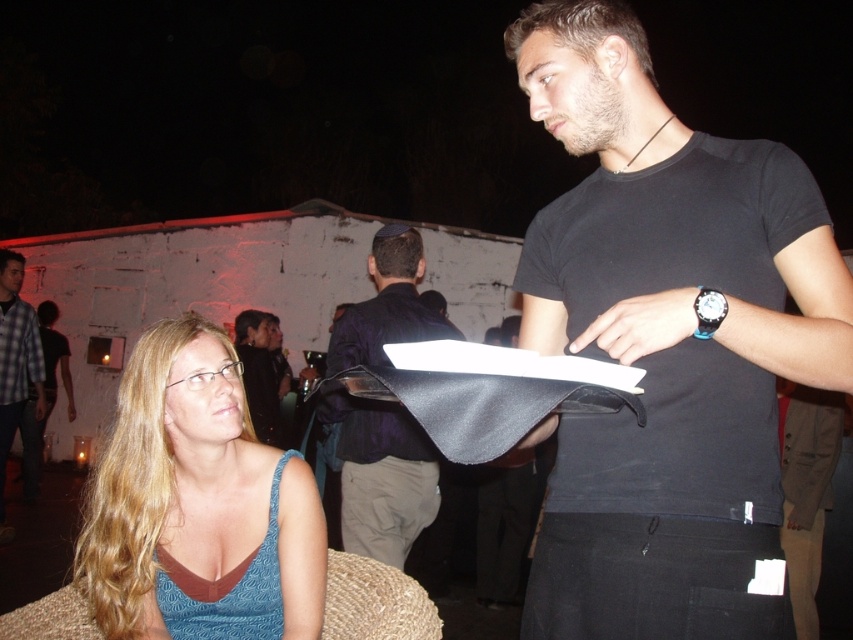
You are at the coordinates where the blue fabric dress at lower left is located. There is a path leading to the entrance of the venue. Which direction should you walk to reach the entrance without crossing any obstacles?

The blue fabric dress at lower left is located at point (196,502). To reach the entrance without crossing obstacles, walk towards the lower right direction as the entrance is likely in that area based on the scene layout.